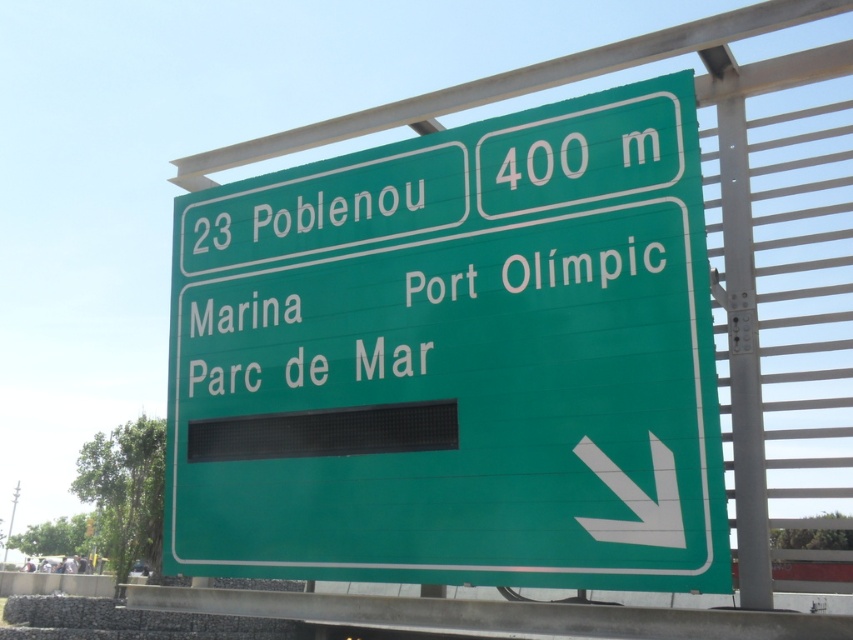
You are standing at the base of the bridge and see the green road sign. There is a point marked at coordinates (445,180). According to the sign, what destination is closest to that point?

The point at (445,180) is on the green matte sign at upper center, so the closest destination would be Marina, as it is listed above the other destinations on the sign.

You are a delivery driver who needs to know the height difference between the green matte sign at upper center and the green metallic sign at center. Can you determine which one is taller?

The green matte sign at upper center has a greater height compared to the green metallic sign at center, so the green matte sign at upper center is taller.